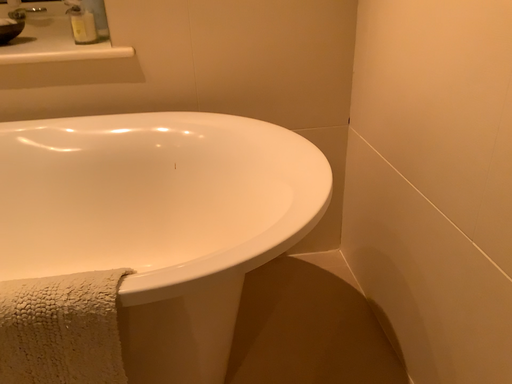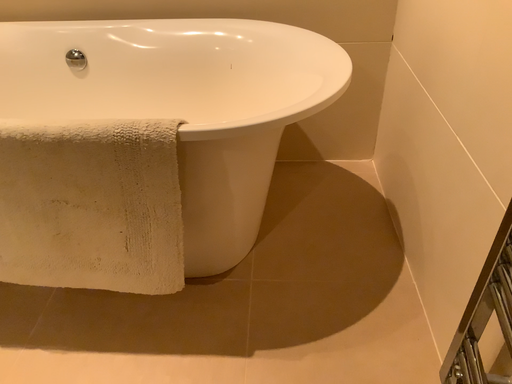
Question: Which way did the camera rotate in the video?

Choices:
 (A) rotated upward
 (B) rotated downward

Answer: (B)